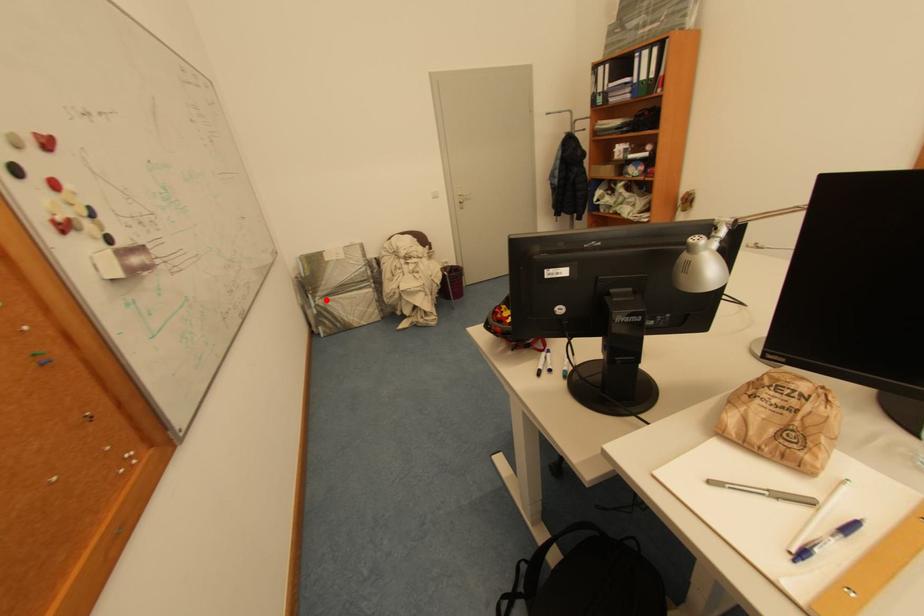
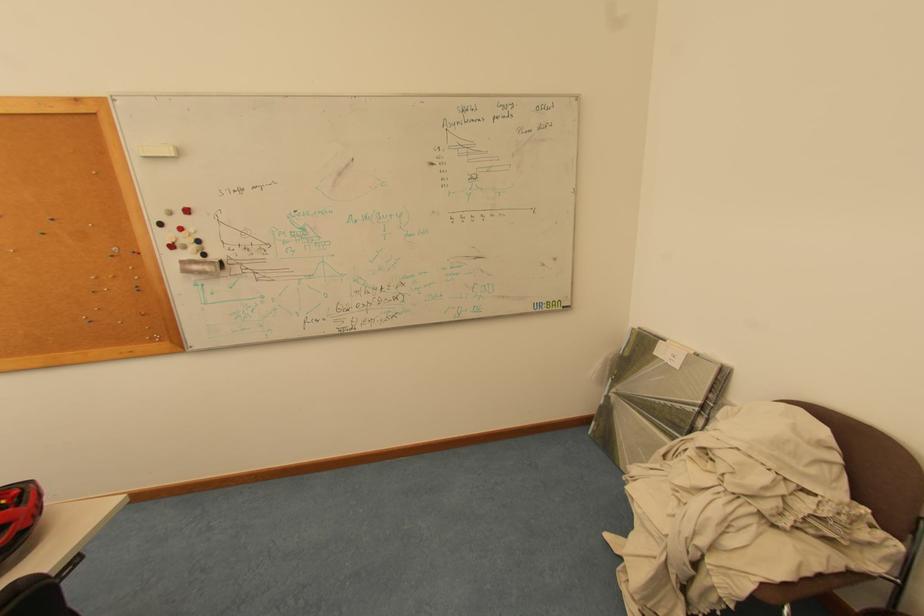
Find the pixel in the second image that matches the highlighted location in the first image.

(622, 392)